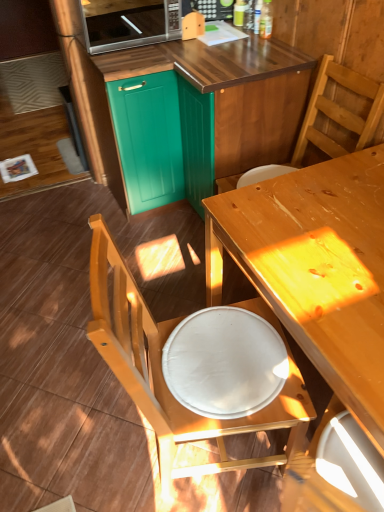
Where is `free space to the left of wooden chair at lower left, the first chair in the bottom-to-top sequence`? The width and height of the screenshot is (384, 512). free space to the left of wooden chair at lower left, the first chair in the bottom-to-top sequence is located at coordinates (87, 434).